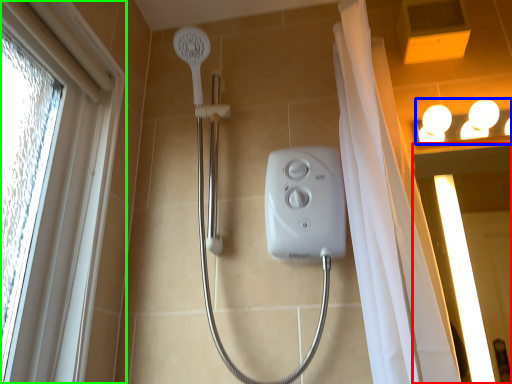
Question: Based on their relative distances, which object is farther from screen door (highlighted by a red box)? Choose from light fixture (highlighted by a blue box) and window (highlighted by a green box).

Choices:
 (A) light fixture
 (B) window

Answer: (B)